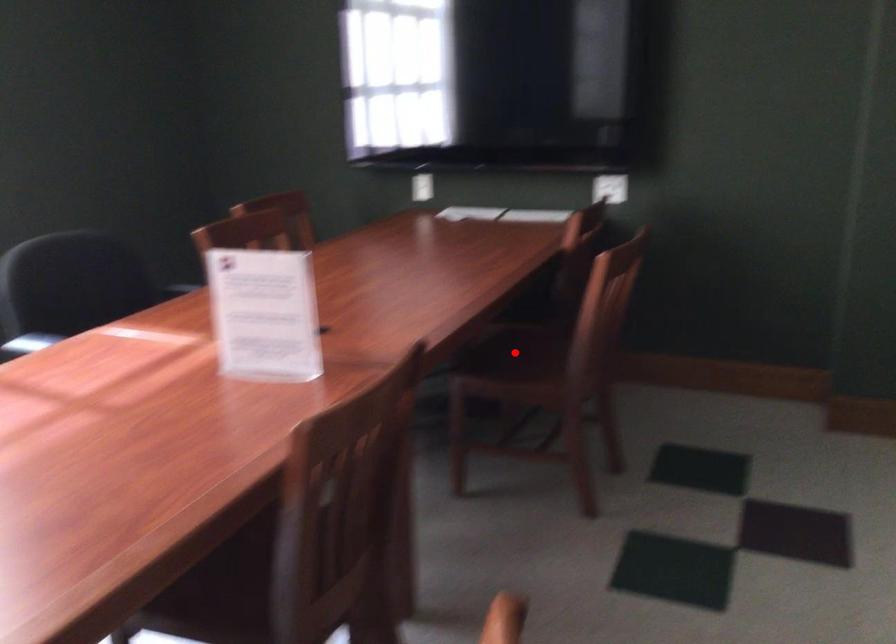
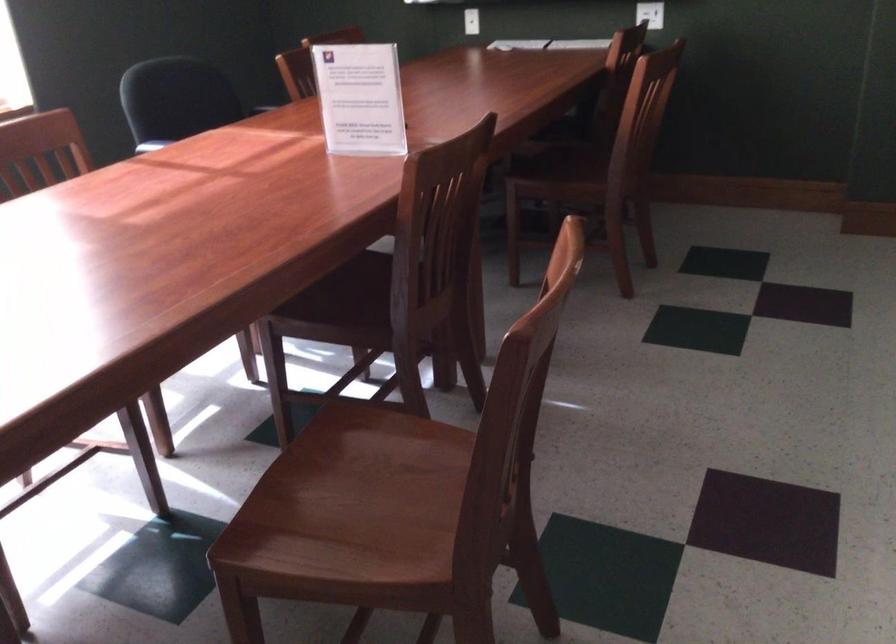
Question: I am providing you with two images of the same scene from different viewpoints. In image1, a red point is highlighted. Considering the same 3D point in image2, which of the following is correct?

Choices:
 (A) It is closer
 (B) It is farther

Answer: (B)